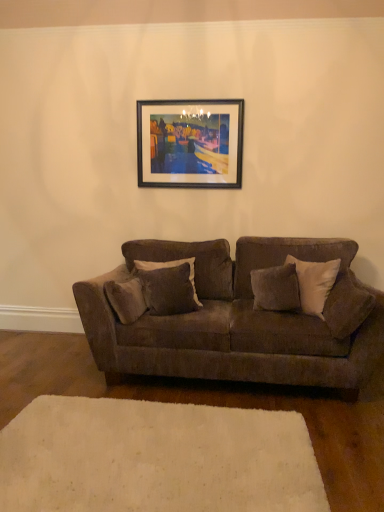
Question: Considering the relative positions of velvet gray pillow at center, the first pillow positioned from the left, and velvety brown pillow at center, the 2th pillow from the left, in the image provided, is velvet gray pillow at center, the first pillow positioned from the left, to the right of velvety brown pillow at center, the 2th pillow from the left, from the viewer's perspective?

Choices:
 (A) yes
 (B) no

Answer: (B)

Question: Is velvet gray pillow at center, the first pillow positioned from the left, bigger than velvety brown pillow at center, the 2th pillow from the left?

Choices:
 (A) no
 (B) yes

Answer: (B)

Question: Is the depth of velvet gray pillow at center, the first pillow positioned from the left, less than that of velvety brown pillow at center, the 2th pillow from the left?

Choices:
 (A) yes
 (B) no

Answer: (B)

Question: Is the surface of velvet gray pillow at center, the first pillow positioned from the left, in direct contact with velvety brown pillow at center, the 2th pillow when ordered from right to left?

Choices:
 (A) no
 (B) yes

Answer: (A)

Question: Are velvet gray pillow at center, which is the third pillow from right to left, and velvety brown pillow at center, the 2th pillow when ordered from right to left, far apart?

Choices:
 (A) no
 (B) yes

Answer: (A)

Question: In the image, is velvet brown couch at center on the left side or the right side of white soft rug at lower center?

Choices:
 (A) left
 (B) right

Answer: (B)

Question: In the image, is velvet brown couch at center positioned in front of or behind white soft rug at lower center?

Choices:
 (A) front
 (B) behind

Answer: (B)

Question: In terms of size, does velvet brown couch at center appear bigger or smaller than white soft rug at lower center?

Choices:
 (A) small
 (B) big

Answer: (B)

Question: Considering the positions of point (92, 289) and point (61, 424), is point (92, 289) closer or farther from the camera than point (61, 424)?

Choices:
 (A) closer
 (B) farther

Answer: (B)

Question: In terms of height, does soft gray fabric pillow at right, the 3th pillow in the left-to-right sequence, look taller or shorter compared to velvet brown couch at center?

Choices:
 (A) tall
 (B) short

Answer: (B)

Question: Relative to velvet brown couch at center, is soft gray fabric pillow at right, which is the first pillow in right-to-left order, in front or behind?

Choices:
 (A) behind
 (B) front

Answer: (B)

Question: From the image's perspective, is soft gray fabric pillow at right, which is the first pillow in right-to-left order, located above or below velvet brown couch at center?

Choices:
 (A) below
 (B) above

Answer: (B)

Question: Does point tap(337, 324) appear closer or farther from the camera than point tap(175, 374)?

Choices:
 (A) closer
 (B) farther

Answer: (A)

Question: Is soft gray fabric pillow at right, which is the first pillow in right-to-left order, inside the boundaries of velvet gray pillow at center, the first pillow positioned from the left, or outside?

Choices:
 (A) inside
 (B) outside

Answer: (B)

Question: Is soft gray fabric pillow at right, the 3th pillow in the left-to-right sequence, wider or thinner than velvet gray pillow at center, the first pillow positioned from the left?

Choices:
 (A) thin
 (B) wide

Answer: (B)